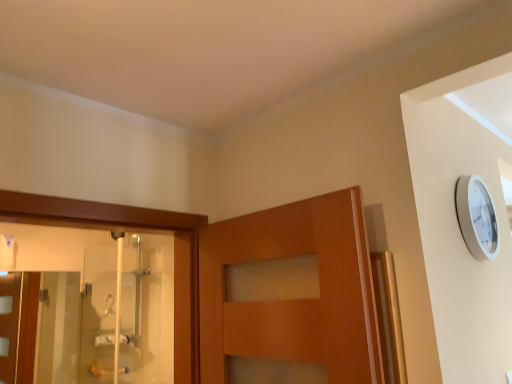
Question: Considering the positions of point (117, 286) and point (52, 301), is point (117, 286) closer or farther from the camera than point (52, 301)?

Choices:
 (A) closer
 (B) farther

Answer: (A)

Question: Relative to transparent glass screen door at left, which is the first screen door from left to right, is clear glass shower door at left, which is the first screen door from right to left, in front or behind?

Choices:
 (A) behind
 (B) front

Answer: (B)

Question: From the image's perspective, is clear glass shower door at left, the second screen door positioned from the left, above or below transparent glass screen door at left, which is the second screen door from right to left?

Choices:
 (A) above
 (B) below

Answer: (A)

Question: Looking at their shapes, would you say transparent glass screen door at left, which is the first screen door from left to right, is wider or thinner than clear glass shower door at left, which is the first screen door from right to left?

Choices:
 (A) thin
 (B) wide

Answer: (B)

Question: From a real-world perspective, relative to clear glass shower door at left, which is the first screen door from right to left, is transparent glass screen door at left, which is the second screen door from right to left, vertically above or below?

Choices:
 (A) above
 (B) below

Answer: (B)

Question: From the image's perspective, is transparent glass screen door at left, which is the first screen door from left to right, positioned above or below clear glass shower door at left, the second screen door positioned from the left?

Choices:
 (A) below
 (B) above

Answer: (A)

Question: Based on their positions, is transparent glass screen door at left, which is the second screen door from right to left, located to the left or right of clear glass shower door at left, the second screen door positioned from the left?

Choices:
 (A) right
 (B) left

Answer: (B)